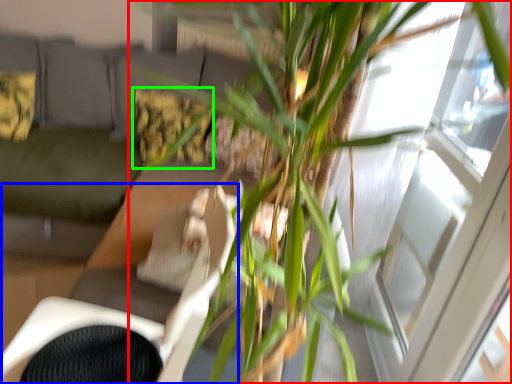
Question: Which object is the closest to the houseplant (highlighted by a red box)? Choose among these: swivel chair (highlighted by a blue box) or pillow (highlighted by a green box).

Choices:
 (A) swivel chair
 (B) pillow

Answer: (A)